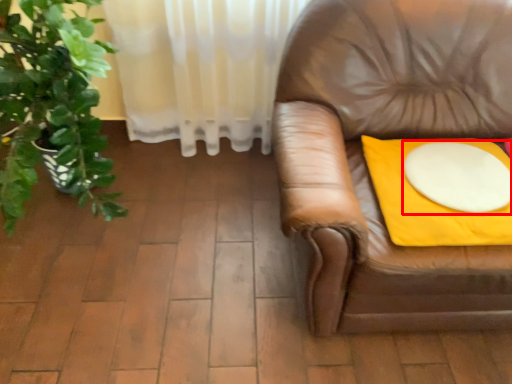
Question: Where is round table (annotated by the red box) located in relation to blanket in the image?

Choices:
 (A) right
 (B) left

Answer: (A)